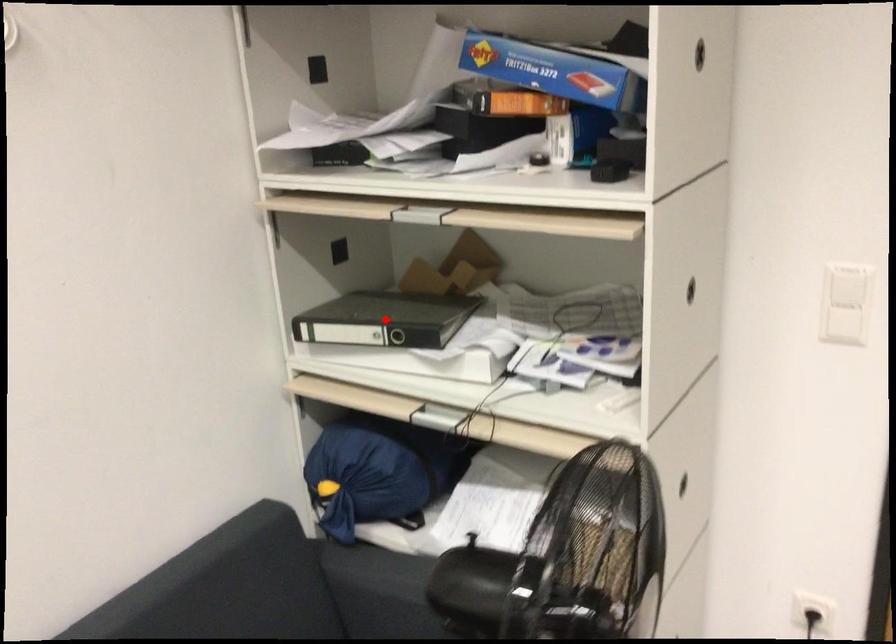
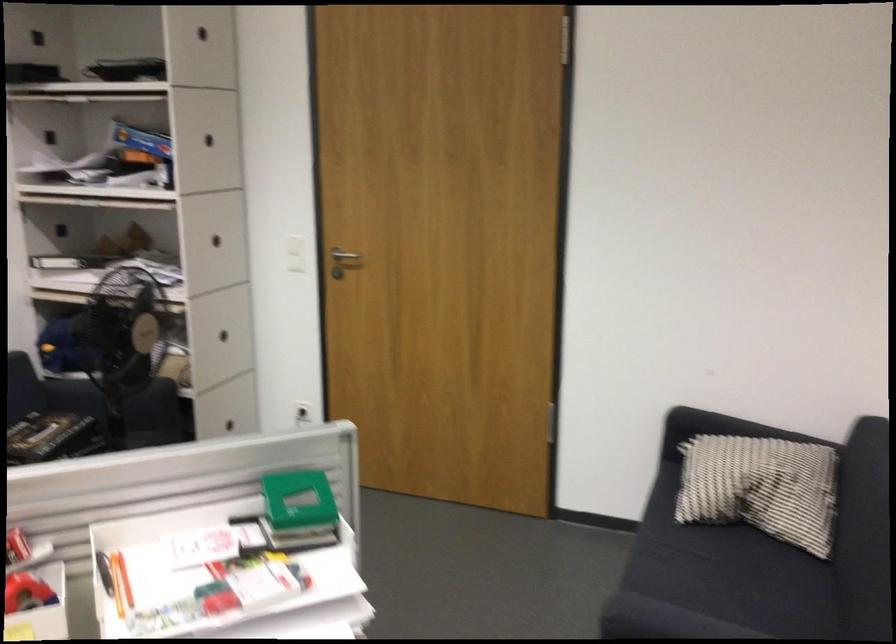
The point at the highlighted location is marked in the first image. Where is the corresponding point in the second image?

(76, 256)